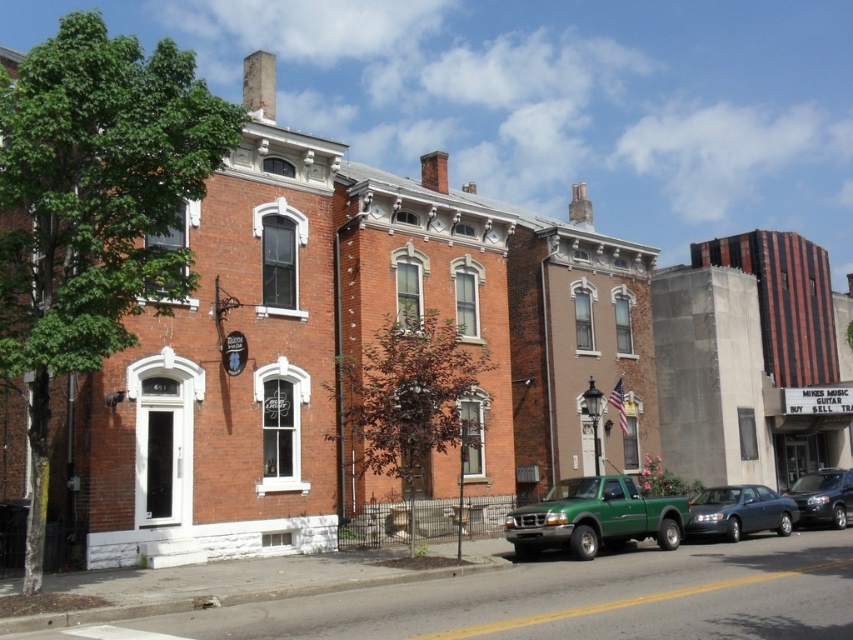
Question: Is green matte truck at lower center thinner than metallic gray sedan at lower right?

Choices:
 (A) no
 (B) yes

Answer: (B)

Question: Among these objects, which one is nearest to the camera?

Choices:
 (A) shiny black suv at center right
 (B) green matte truck at lower center
 (C) metallic gray sedan at lower right

Answer: (B)

Question: Which point is closer to the camera taking this photo?

Choices:
 (A) (706, 493)
 (B) (651, 532)

Answer: (B)

Question: Estimate the real-world distances between objects in this image. Which object is closer to the shiny black suv at center right?

Choices:
 (A) metallic gray sedan at lower right
 (B) green matte truck at lower center

Answer: (A)

Question: Is metallic gray sedan at lower right to the left of shiny black suv at center right from the viewer's perspective?

Choices:
 (A) no
 (B) yes

Answer: (B)

Question: Does metallic gray sedan at lower right appear on the right side of shiny black suv at center right?

Choices:
 (A) no
 (B) yes

Answer: (A)